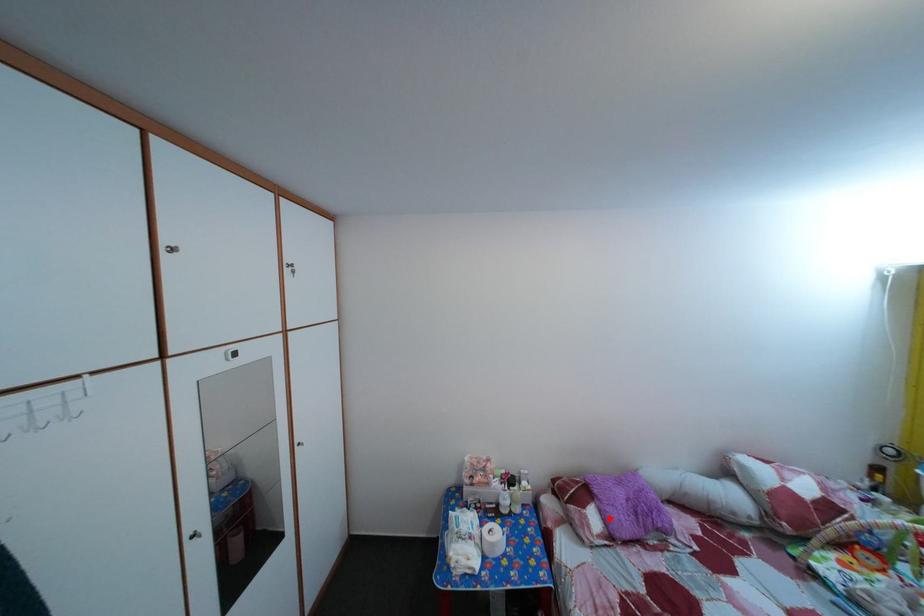
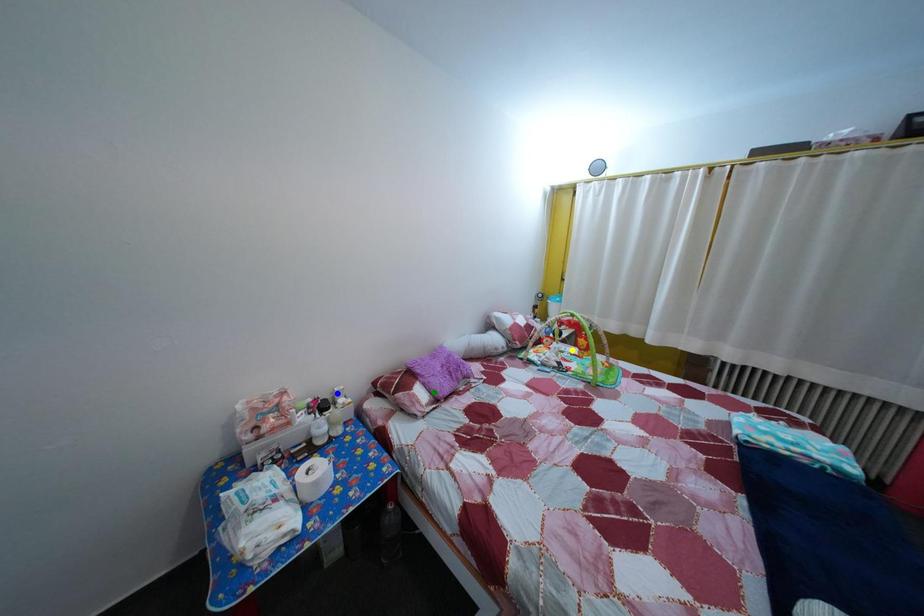
Question: I am providing you with two images of the same scene from different viewpoints. A red point is marked on the first image. You are given multiple points on the second image. Which point in image 2 is actually the same real-world point as the red point in image 1?

Choices:
 (A) yellow point
 (B) green point
 (C) blue point

Answer: (B)